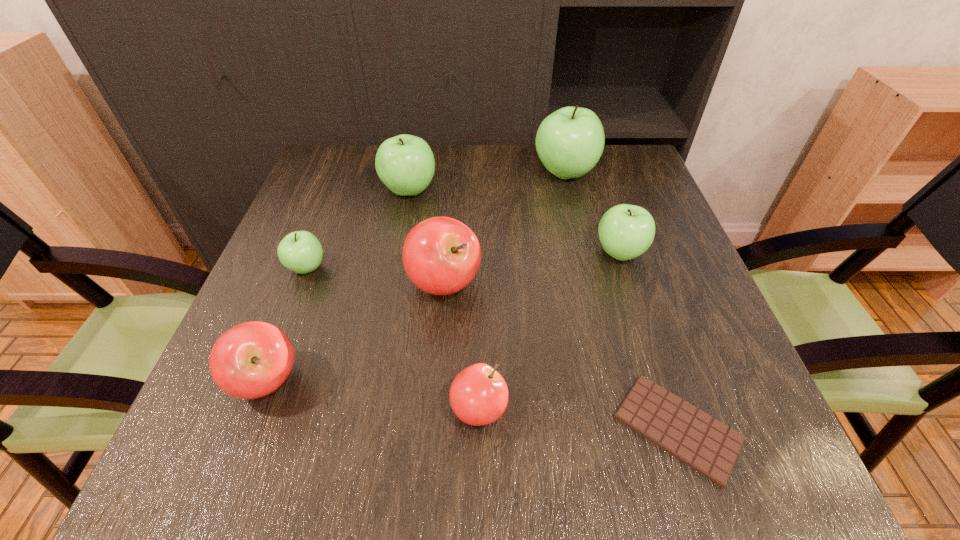
Locate an element on the screen. chocolate bar situated at the right edge is located at coordinates (708, 446).

I want to click on object positioned at the far right corner, so click(570, 141).

Locate an element on the screen. This screenshot has height=540, width=960. object positioned at the near right corner is located at coordinates (708, 446).

Locate an element on the screen. This screenshot has height=540, width=960. free point at the far edge is located at coordinates (443, 155).

Locate an element on the screen. The height and width of the screenshot is (540, 960). vacant space at the near edge is located at coordinates (621, 454).

I want to click on vacant space at the left edge, so click(327, 313).

Image resolution: width=960 pixels, height=540 pixels. I want to click on vacant space at the right edge, so click(616, 204).

At what (x,y) coordinates should I click in order to perform the action: click on free location at the far right corner. Please return your answer as a coordinate pair (x, y). Looking at the image, I should click on (623, 178).

Where is `free space between the third biggest green apple and the second smallest red apple`? free space between the third biggest green apple and the second smallest red apple is located at coordinates (444, 316).

Where is `unoccupied area between the smallest red apple and the leftmost green apple`? unoccupied area between the smallest red apple and the leftmost green apple is located at coordinates point(393,339).